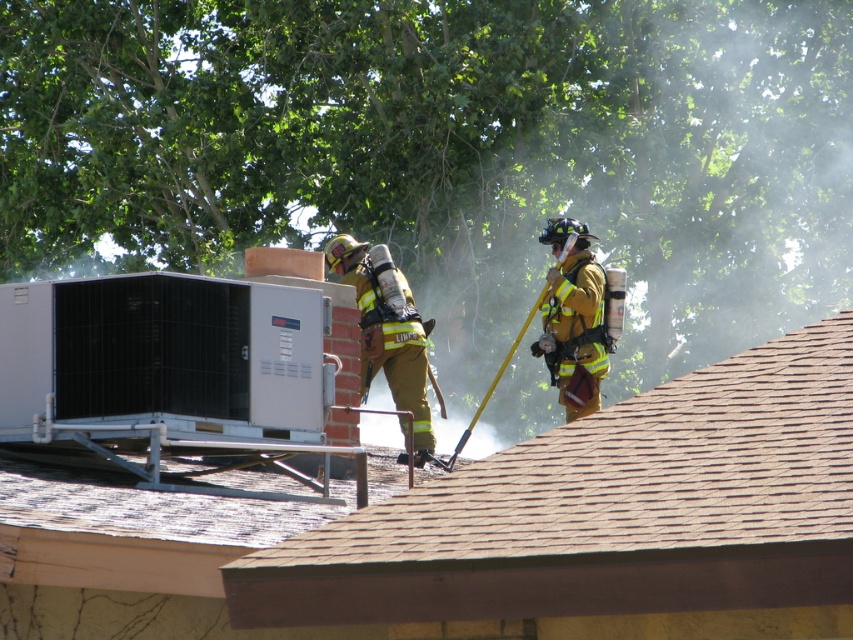
You are a firefighter on the roof and need to place a tool between the brown shingles at upper center and the firefighter yellow uniform at center. Which object should you place the tool closer to if you want it to be near the larger object?

The brown shingles at upper center is bigger than the firefighter yellow uniform at center, so you should place the tool closer to the brown shingles at upper center.

You are a drone operator trying to land a drone on the roof. The drone has a GPS coordinate that corresponds to the point labeled as point (605, 513). Where exactly on the roof should you direct the drone to land?

The point (605, 513) is located on the brown shingles at upper center of the roof, so you should direct the drone to land on the brown shingles at upper center.

Looking at this image, you are a firefighter on the roof and need to locate your helmet. You see the brown shingles at upper center and the reflective gold helmet at upper right. Which object is positioned to the right of the other?

The reflective gold helmet at upper right is positioned to the right of the brown shingles at upper center.